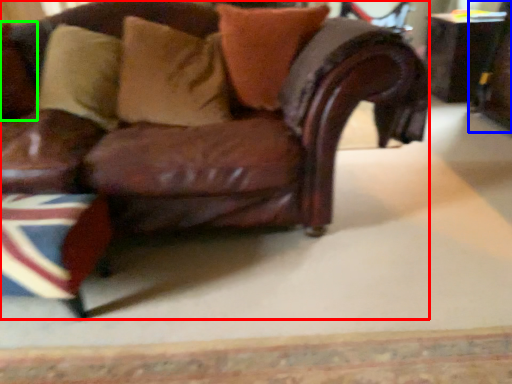
Question: Estimate the real-world distances between objects in this image. Which object is farther from chair (highlighted by a red box), swivel chair (highlighted by a blue box) or pillow (highlighted by a green box)?

Choices:
 (A) swivel chair
 (B) pillow

Answer: (A)